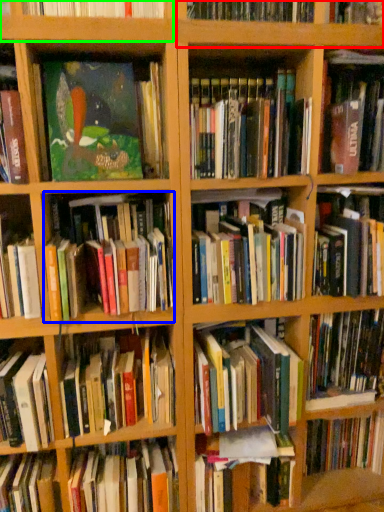
Question: Which is nearer to the shelf (highlighted by a red box)? book (highlighted by a blue box) or shelf (highlighted by a green box).

Choices:
 (A) book
 (B) shelf

Answer: (B)